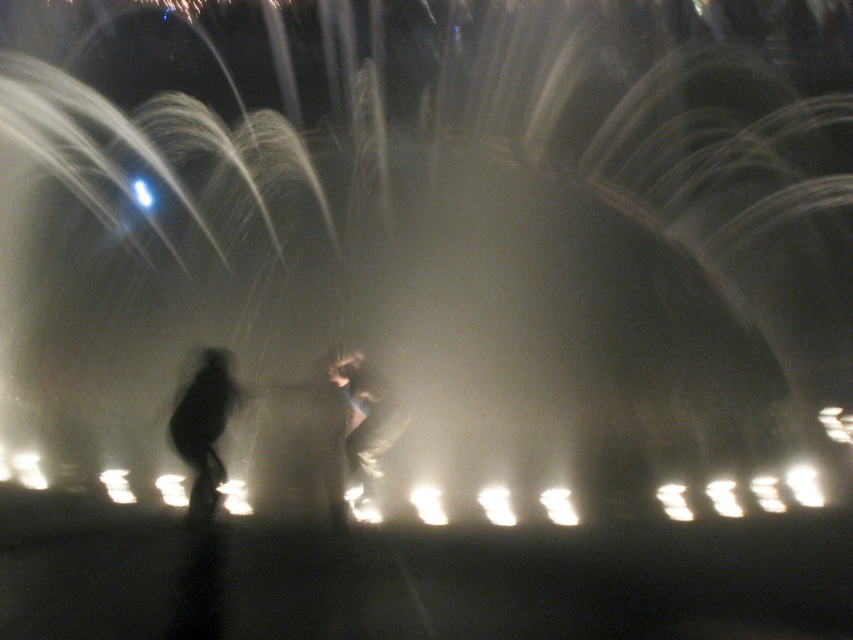
Identify the location of silhouette figure at center. (349, 428).